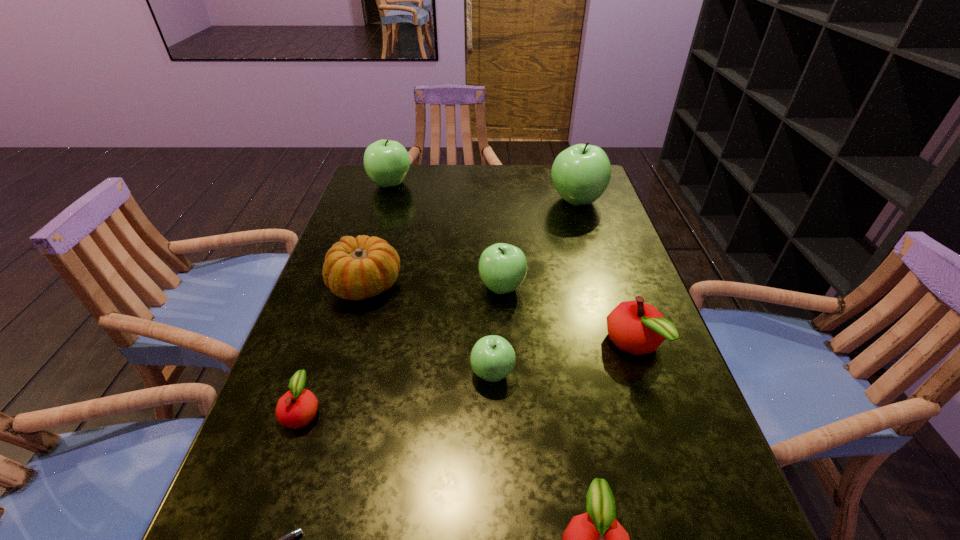
Locate an element on the screen. This screenshot has width=960, height=540. the shortest apple is located at coordinates (296, 408).

Where is `the second nearest red apple`? The image size is (960, 540). the second nearest red apple is located at coordinates (296, 408).

The height and width of the screenshot is (540, 960). Identify the location of vacant space located 0.110m on the front of the tallest object. (588, 238).

The image size is (960, 540). What are the coordinates of `vacant space located on the right of the second biggest green apple` in the screenshot? It's located at (499, 184).

At what (x,y) coordinates should I click in order to perform the action: click on free point located 0.330m on the front of the third farthest apple. Please return your answer as a coordinate pair (x, y). Looking at the image, I should click on (511, 438).

Find the location of `vacant space located on the back of the gourd`. vacant space located on the back of the gourd is located at coordinates (x=394, y=186).

The height and width of the screenshot is (540, 960). In order to click on free space located 0.270m on the left of the farthest red apple in this screenshot , I will do `click(474, 345)`.

Where is `blank space located on the front of the smallest green apple`? The image size is (960, 540). blank space located on the front of the smallest green apple is located at coordinates (496, 516).

Image resolution: width=960 pixels, height=540 pixels. I want to click on free spot located on the back of the second shortest object, so click(x=324, y=344).

Identify the location of gourd situated at the left edge. This screenshot has width=960, height=540. (357, 268).